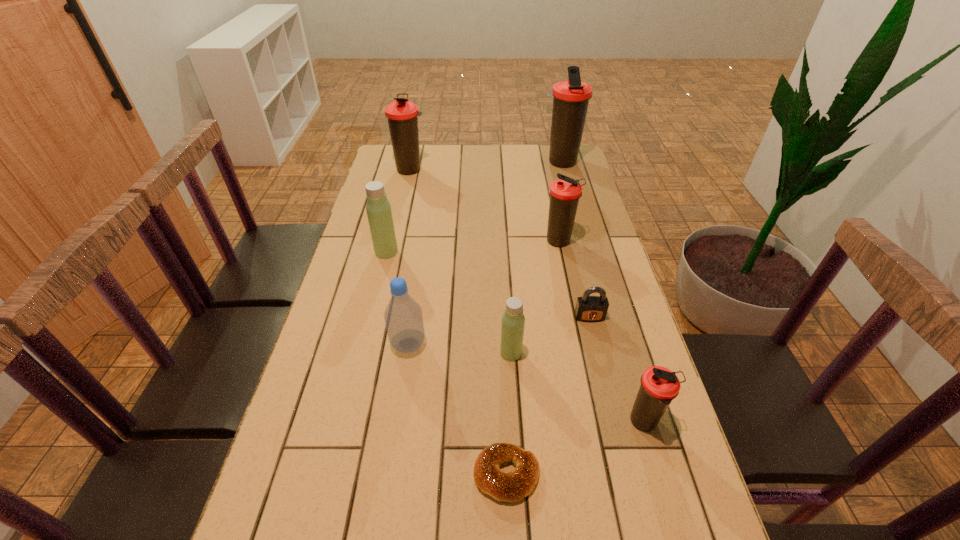
Locate an element on the screen. the biggest brown thermos bottle is located at coordinates click(571, 98).

I want to click on the tallest object, so click(x=571, y=98).

The image size is (960, 540). I want to click on the second tallest thermos bottle, so click(x=402, y=114).

You are a GUI agent. You are given a task and a screenshot of the screen. Output one action in this format:
    pyautogui.click(x=<x>, y=<y>)
    Task: Click on the third smallest brown thermos bottle
    Image resolution: width=960 pixels, height=540 pixels.
    Given the screenshot: What is the action you would take?
    pyautogui.click(x=402, y=114)

The image size is (960, 540). I want to click on the second nearest brown thermos bottle, so click(565, 192).

At what (x,y) coordinates should I click in order to perform the action: click on the left light thermos bottle. Please return your answer as a coordinate pair (x, y). Looking at the image, I should click on (378, 208).

I want to click on the farther light thermos bottle, so click(x=378, y=208).

Locate an element on the screen. This screenshot has width=960, height=540. gray bottle is located at coordinates (403, 317).

Image resolution: width=960 pixels, height=540 pixels. Find the location of `the second nearest object`. the second nearest object is located at coordinates (659, 386).

This screenshot has height=540, width=960. Find the location of `the smallest brown thermos bottle`. the smallest brown thermos bottle is located at coordinates (659, 386).